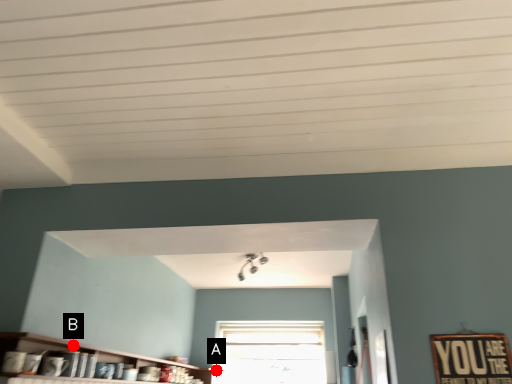
Question: Two points are circled on the image, labeled by A and B beside each circle. Which point is farther to the camera?

Choices:
 (A) A is further
 (B) B is further

Answer: (A)